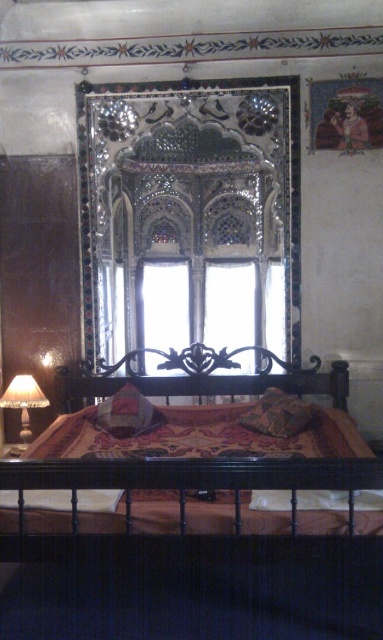
You are standing in the room and want to touch both the wooden bed at center and the black wrought iron headboard at center. Which object should you reach for first to touch the one closer to you?

The wooden bed at center is closer to you than the black wrought iron headboard at center, so you should reach for the wooden bed at center first.

You are an interior designer assessing the placement of the patterned fabric bedspread at center and the translucent glass lampshade at left. Based on their positions, which object is located lower in the scene?

The patterned fabric bedspread at center is located lower than the translucent glass lampshade at left because it is positioned below it.